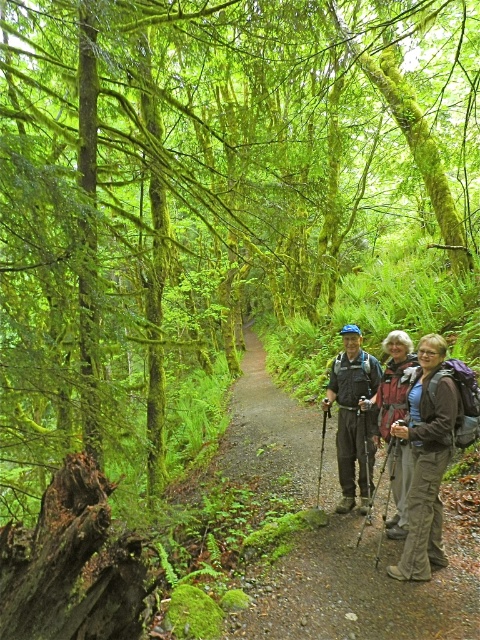
Between gravel path at center and brown fabric backpack at right, which one appears on the left side from the viewer's perspective?

From the viewer's perspective, gravel path at center appears more on the left side.

Is the position of gravel path at center less distant than that of brown fabric backpack at right?

Yes, gravel path at center is closer to the viewer.

Who is more distant from viewer, (343, 604) or (430, 508)?

The point (430, 508) is more distant.

At what (x,y) coordinates should I click in order to perform the action: click on gravel path at center. Please return your answer as a coordinate pair (x, y). Looking at the image, I should click on (356, 586).

Between matte gray jacket at center and brown fabric backpack at right, which one has less height?

brown fabric backpack at right

Describe the element at coordinates (424, 480) in the screenshot. Image resolution: width=480 pixels, height=640 pixels. I see `matte gray jacket at center` at that location.

Is point (440, 410) positioned behind point (408, 566)?

No, (440, 410) is in front of (408, 566).

Find the location of `matte gray jacket at center`. matte gray jacket at center is located at coordinates (424, 480).

Is point (391, 381) farther from viewer compared to point (354, 420)?

No, it is in front of (354, 420).

Is matte gray jacket at center above matte blue helmet at center?

Actually, matte gray jacket at center is below matte blue helmet at center.

Between point (411, 468) and point (350, 464), which one is positioned in front?

Positioned in front is point (411, 468).

The height and width of the screenshot is (640, 480). Identify the location of matte gray jacket at center. (424, 480).